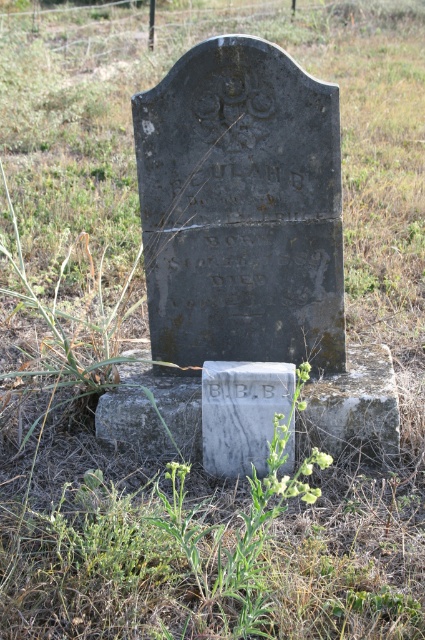
Describe the element at coordinates (235, 532) in the screenshot. I see `green leafy weed at center` at that location.

Is green leafy weed at center bigger than white marble gravestone at center?

Indeed, green leafy weed at center has a larger size compared to white marble gravestone at center.

Is point (215, 634) more distant than point (238, 470)?

No, it is in front of (238, 470).

Where is `green leafy weed at center`? The image size is (425, 640). green leafy weed at center is located at coordinates (235, 532).